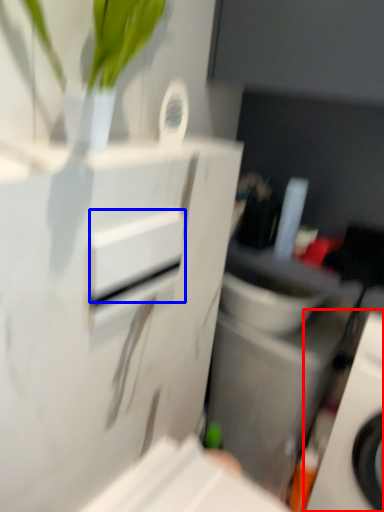
Question: Which object is further to the camera taking this photo, home appliance (highlighted by a red box) or drawer (highlighted by a blue box)?

Choices:
 (A) home appliance
 (B) drawer

Answer: (A)